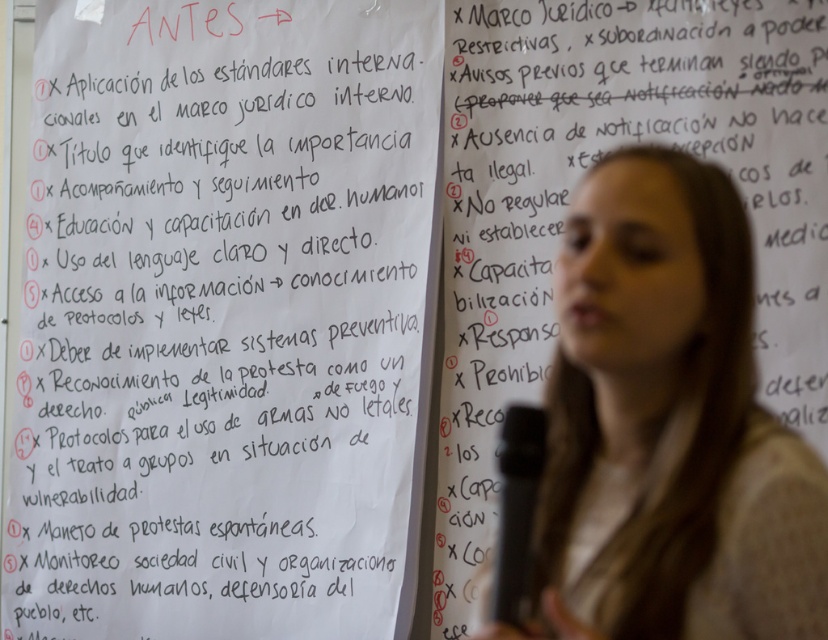
Question: Is blonde hair at center to the left of black plastic microphone at lower center from the viewer's perspective?

Choices:
 (A) yes
 (B) no

Answer: (B)

Question: Can you confirm if white paper at upper left is bigger than black plastic microphone at lower center?

Choices:
 (A) yes
 (B) no

Answer: (A)

Question: Which point is closer to the camera?

Choices:
 (A) white paper at upper left
 (B) blonde hair at center
 (C) black plastic microphone at lower center

Answer: (B)

Question: Based on their relative distances, which object is farther from the white paper at upper left?

Choices:
 (A) blonde hair at center
 (B) black plastic microphone at lower center

Answer: (B)

Question: Is white paper at upper left further to camera compared to blonde hair at center?

Choices:
 (A) no
 (B) yes

Answer: (B)

Question: Which point is farther to the camera?

Choices:
 (A) (340, 344)
 (B) (504, 611)
 (C) (694, 164)

Answer: (A)